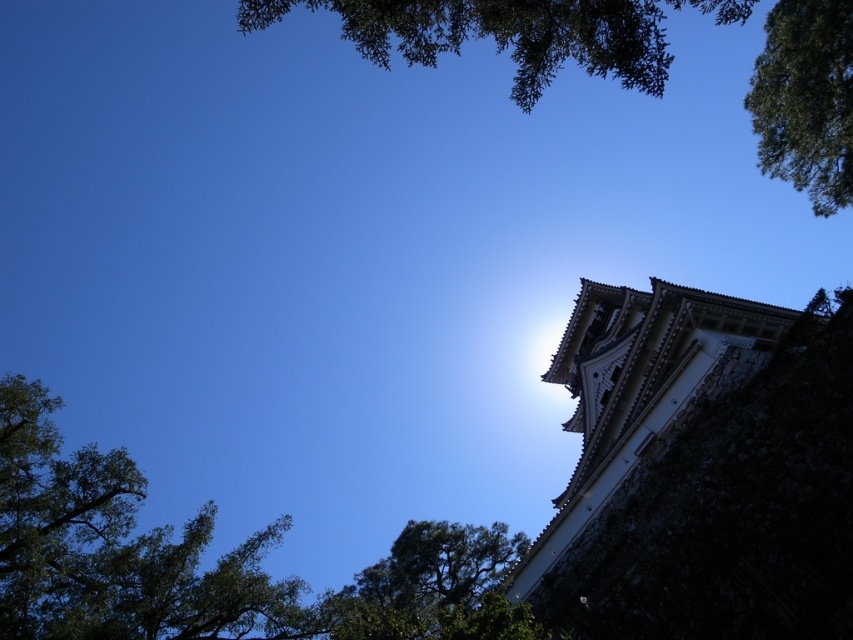
You are standing at the base of the building shown in the image. Looking up, you notice a specific point marked at coordinates [700,468]. What architectural feature does this point correspond to?

The point at [700,468] corresponds to the white stone tower at upper right.

You are a drone operator tasked with capturing aerial footage of the white stone tower at upper right and the green leafy tree at upper center. The drone has a maximum flight range of 30 meters. Can the drone safely capture footage of both objects without exceeding its range limit?

The distance between the white stone tower at upper right and the green leafy tree at upper center is 25.31 meters, which is within the drone operator maximum flight range of 30 meters. Yes, the drone can safely capture footage of both objects without exceeding its range limit.